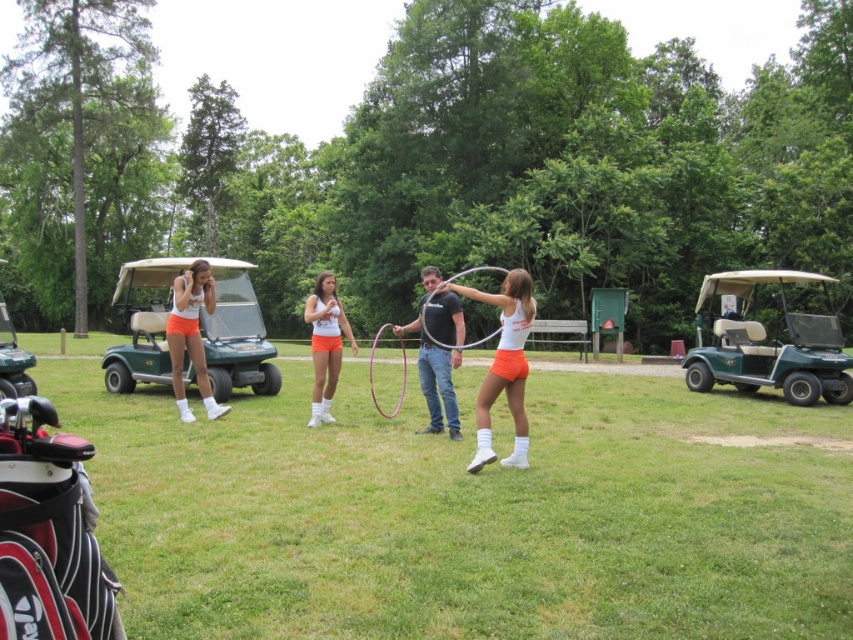
Is white matte tank top at center further to the viewer compared to orange matte shorts at center?

No, white matte tank top at center is in front of orange matte shorts at center.

Between white matte tank top at center and orange matte shorts at center, which one is positioned higher?

Positioned higher is orange matte shorts at center.

Which is behind, point (508, 460) or point (322, 337)?

The point (322, 337) is more distant.

The width and height of the screenshot is (853, 640). I want to click on white matte tank top at center, so click(503, 365).

Which is behind, point (788, 380) or point (518, 458)?

Point (788, 380)

Who is more forward, (x=815, y=337) or (x=523, y=333)?

Point (x=523, y=333)

This screenshot has height=640, width=853. Find the location of `green matte golf cart at right`. green matte golf cart at right is located at coordinates (770, 344).

This screenshot has height=640, width=853. Find the location of `green matte golf cart at right`. green matte golf cart at right is located at coordinates (770, 344).

Does green matte golf cart at left have a greater height compared to green plastic golf cart at left?

Yes.

Which is below, green matte golf cart at left or green plastic golf cart at left?

green plastic golf cart at left

Does point (207, 257) come closer to viewer compared to point (3, 346)?

No, it is not.

What are the coordinates of `green matte golf cart at left` in the screenshot? It's located at (199, 328).